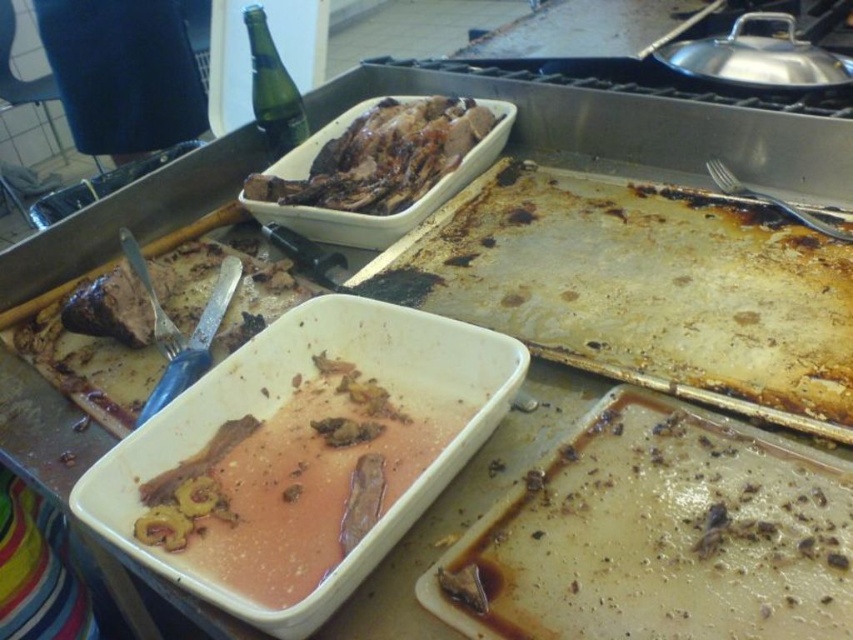
Is point (268, 550) less distant than point (373, 118)?

That is True.

Between point (215, 492) and point (335, 134), which one is positioned behind?

The point (335, 134) is more distant.

At what (x,y) coordinates should I click in order to perform the action: click on pink glossy sauce at center. Please return your answer as a coordinate pair (x, y). This screenshot has height=640, width=853. Looking at the image, I should click on (289, 483).

Based on the photo, is pink glossy sauce at center wider than brown matte meat at center-left?

Incorrect, pink glossy sauce at center's width does not surpass brown matte meat at center-left's.

Find the location of a particular element. The width and height of the screenshot is (853, 640). pink glossy sauce at center is located at coordinates click(289, 483).

Image resolution: width=853 pixels, height=640 pixels. Describe the element at coordinates (289, 483) in the screenshot. I see `pink glossy sauce at center` at that location.

Identify the location of pink glossy sauce at center. The width and height of the screenshot is (853, 640). (289, 483).

Does brown matte meat at center-left have a lesser width compared to green glass bottle at upper left?

No.

Is brown matte meat at center-left to the right of green glass bottle at upper left from the viewer's perspective?

In fact, brown matte meat at center-left is to the left of green glass bottle at upper left.

Does point (50, 376) come in front of point (279, 92)?

Yes, point (50, 376) is in front of point (279, 92).

Identify the location of brown matte meat at center-left. The image size is (853, 640). (97, 348).